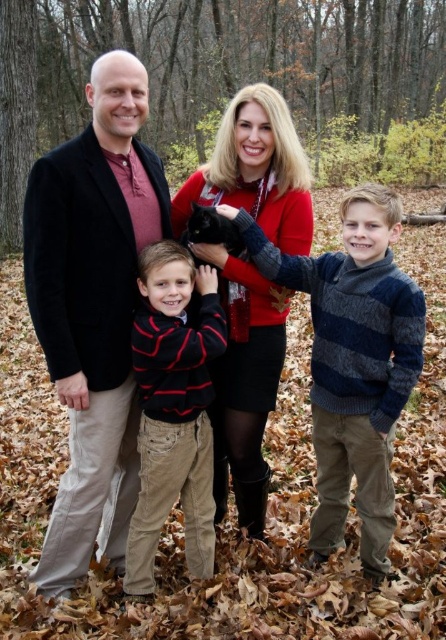
You are a tailor measuring the distance between two sweaters for a fitting. The striped wool sweater at center and the velvet red sweater at center are part of a display. Can you fit a 30 inch wide box between them without moving the sweaters?

The striped wool sweater at center is 29.90 inches from the velvet red sweater at center, so the 30 inch wide box cannot fit between them as the distance is slightly less than required.

You are a tailor who needs to compare the width of the black cotton jacket at left and the velvet red sweater at center. Which one is wider?

The black cotton jacket at left is wider than the velvet red sweater at center according to the description.